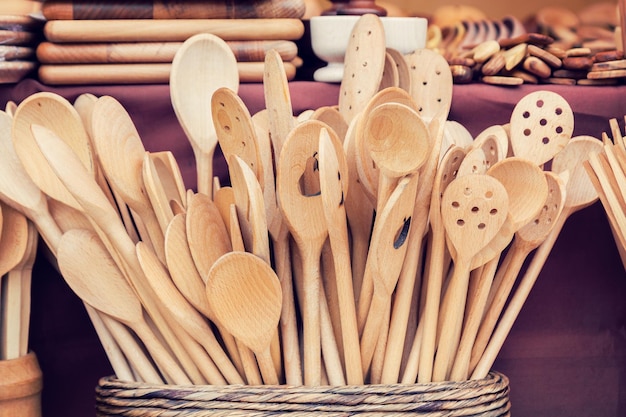
This screenshot has height=417, width=626. Find the location of `basket`. basket is located at coordinates [x=218, y=403].